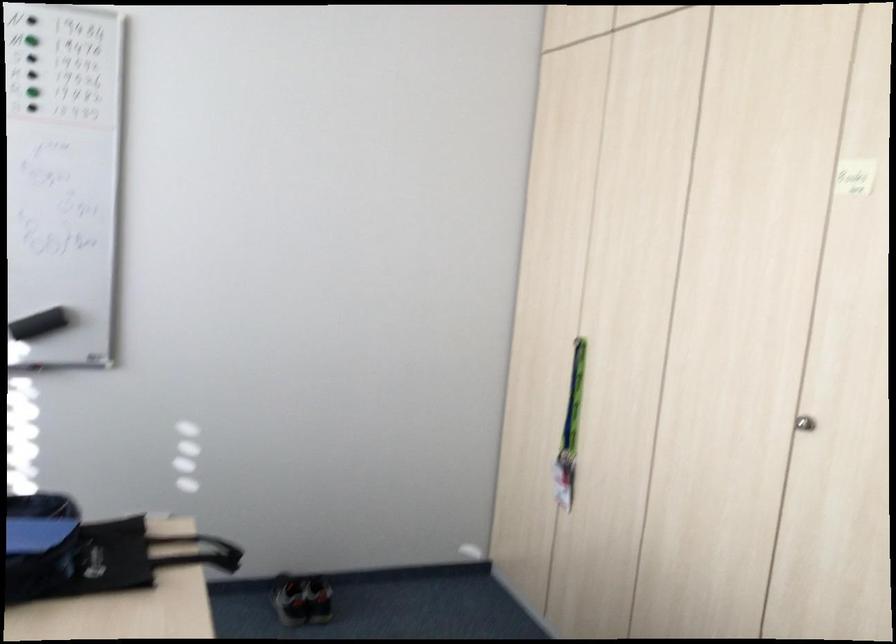
Where would you peel the yellow sticky note? Please return your answer as a coordinate pair (x, y).

(855, 176)